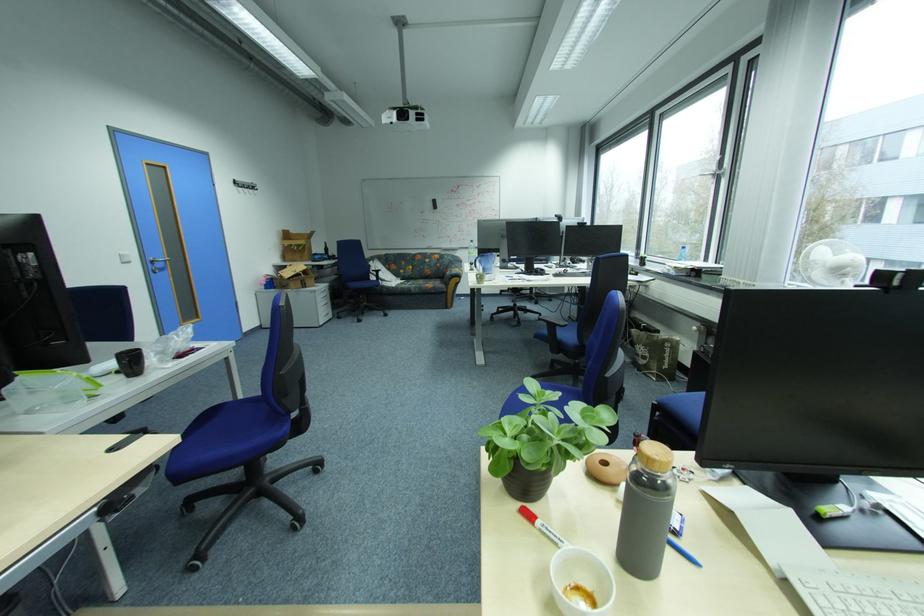
Find where to pull the cabinet drawer handle. Please return your answer as a coordinate pair (x, y).

(324, 314)